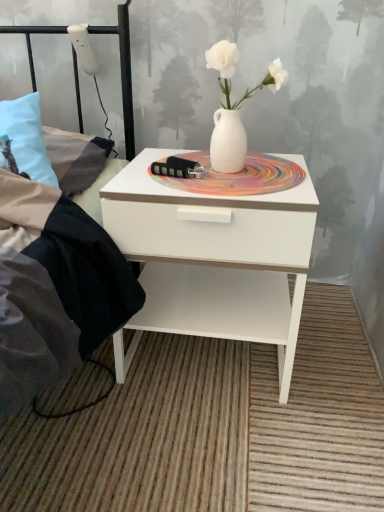
Question: Which is correct: white glossy nightstand at center is inside black metal bed frame at upper left, or outside of it?

Choices:
 (A) outside
 (B) inside

Answer: (A)

Question: Is white glossy nightstand at center to the left or to the right of black metal bed frame at upper left in the image?

Choices:
 (A) left
 (B) right

Answer: (B)

Question: Looking at their shapes, would you say white glossy nightstand at center is wider or thinner than black metal bed frame at upper left?

Choices:
 (A) wide
 (B) thin

Answer: (B)

Question: From the image's perspective, is black metal bed frame at upper left positioned above or below white glossy nightstand at center?

Choices:
 (A) below
 (B) above

Answer: (B)

Question: From a real-world perspective, is black metal bed frame at upper left above or below white glossy nightstand at center?

Choices:
 (A) above
 (B) below

Answer: (A)

Question: Based on their sizes in the image, would you say black metal bed frame at upper left is bigger or smaller than white glossy nightstand at center?

Choices:
 (A) small
 (B) big

Answer: (B)

Question: Considering the positions of black metal bed frame at upper left and white glossy nightstand at center in the image, is black metal bed frame at upper left taller or shorter than white glossy nightstand at center?

Choices:
 (A) tall
 (B) short

Answer: (B)